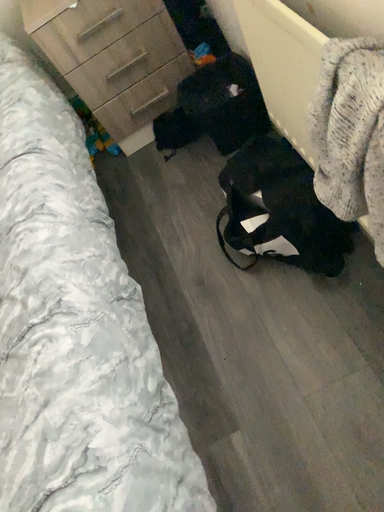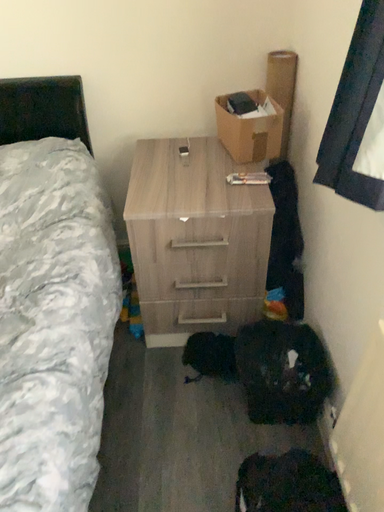
Question: How did the camera likely rotate when shooting the video?

Choices:
 (A) rotated upward
 (B) rotated downward

Answer: (A)